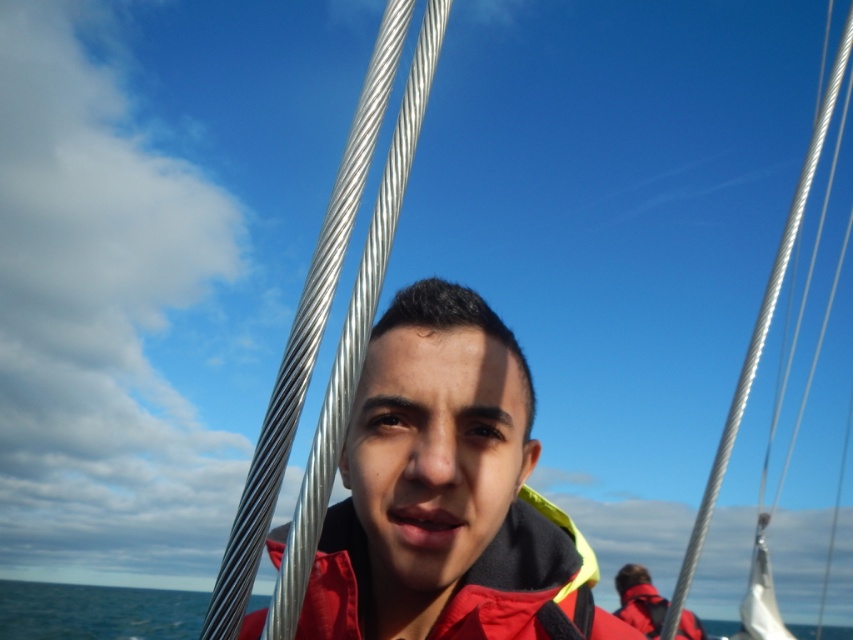
You are a photographer trying to capture the perfect shot of the matte red jacket at center. The jacket is located at coordinates point 0.772, 0.524. If your camera has a standard 50mm lens with a field of view of 46 degrees, can you estimate whether the jacket will be fully visible in the frame?

The matte red jacket at center is positioned at coordinates point (445, 493). Since the camera lens has a field of view of 46 degrees, the jacket will be fully visible within the frame as long as it is within the lens coverage area, which it is based on the given coordinates.